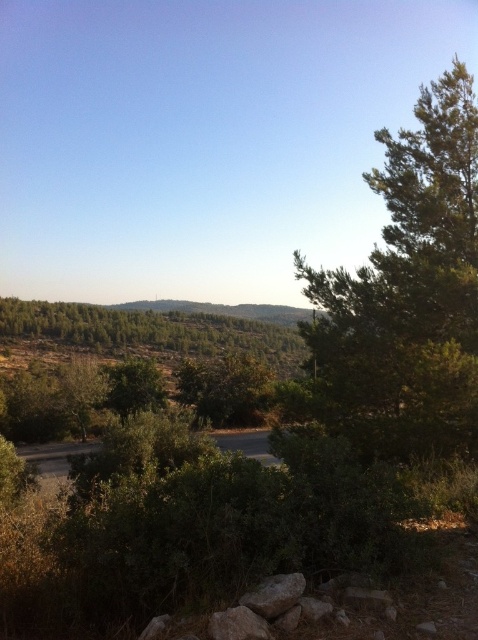
You are a hiker trying to decide which landmark to use for navigation. Based on the image, which of the two objects, the green leafy tree at right or the green textured hillside at center, is a better choice for a tall landmark?

The green leafy tree at right is taller than the green textured hillside at center, making it a better choice for a tall landmark.

You are standing on the dirt path and want to walk towards the green textured hill at center. Which direction should you walk to avoid the green leafy tree at right?

You should walk towards the left side of the dirt path to avoid the green leafy tree at right, as it is closer to you and blocking the path to the green textured hill at center.